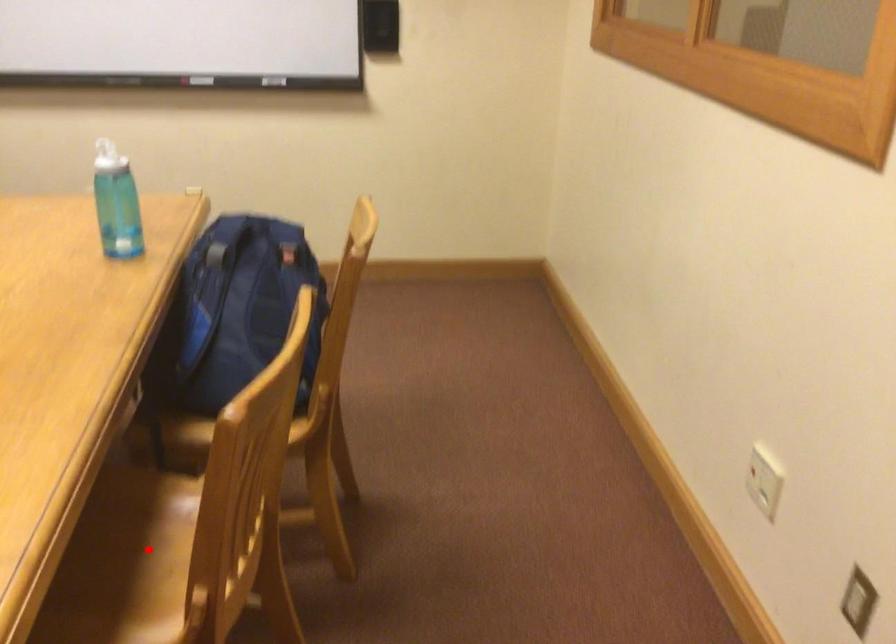
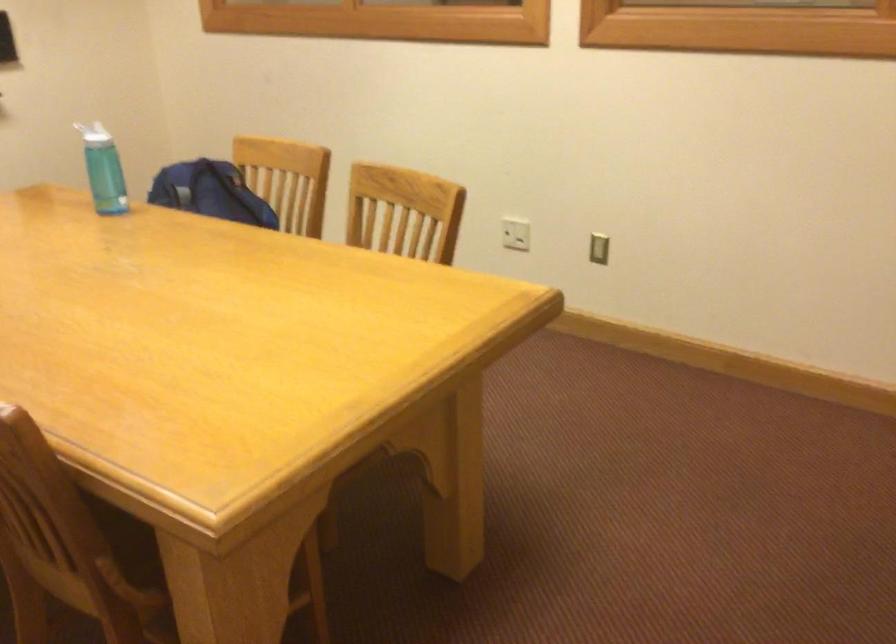
Question: I am providing you with two images of the same scene from different viewpoints. A red point is marked on the first image. At the location where the point appears in image 1, is it still visible in image 2?

Choices:
 (A) Yes
 (B) No

Answer: (B)